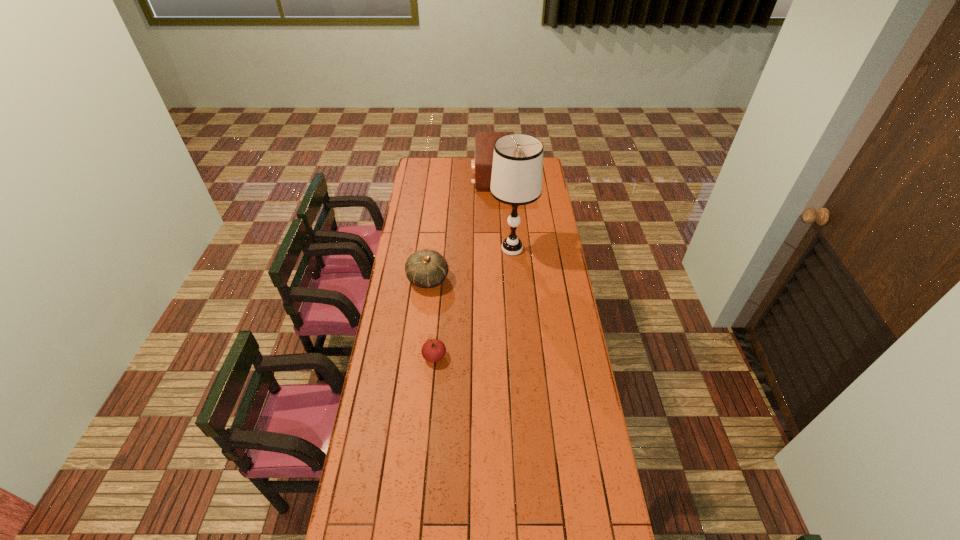
In order to click on table lamp in this screenshot , I will do `click(517, 170)`.

This screenshot has width=960, height=540. Identify the location of the third nearest object. (517, 170).

Where is `the second tallest object`? The height and width of the screenshot is (540, 960). the second tallest object is located at coordinates (481, 166).

Find the location of a particular element. Image resolution: width=960 pixels, height=540 pixels. the farthest object is located at coordinates (481, 166).

Locate an element on the screen. The image size is (960, 540). the second nearest object is located at coordinates (427, 268).

Locate an element on the screen. the third tallest object is located at coordinates (427, 268).

This screenshot has height=540, width=960. In order to click on tomato in this screenshot , I will do `click(433, 350)`.

This screenshot has height=540, width=960. Identify the location of the shortest object. point(433,350).

Where is `free space located on the right of the tallest object`? This screenshot has width=960, height=540. free space located on the right of the tallest object is located at coordinates (553, 249).

Image resolution: width=960 pixels, height=540 pixels. I want to click on free space located on the front panel of the radio receiver, so click(x=413, y=176).